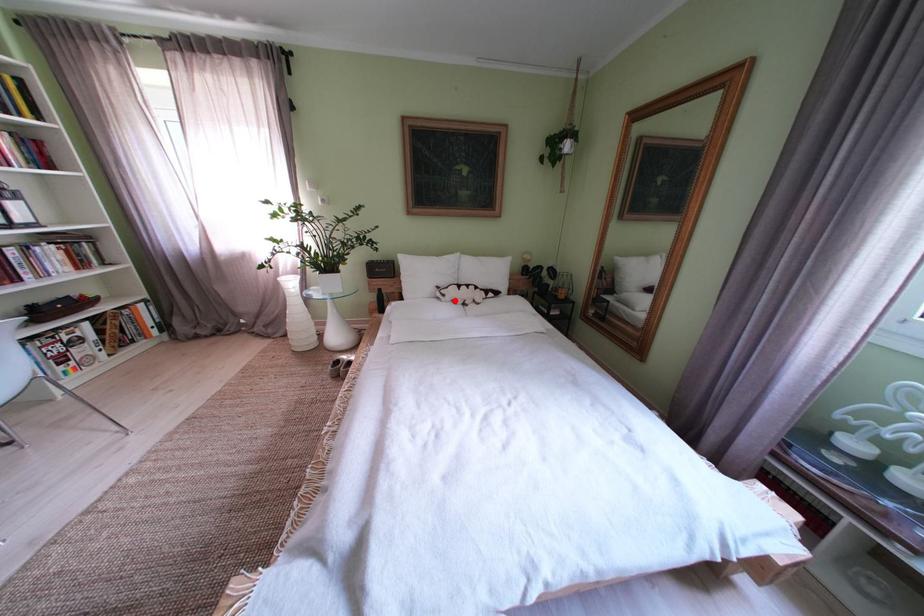
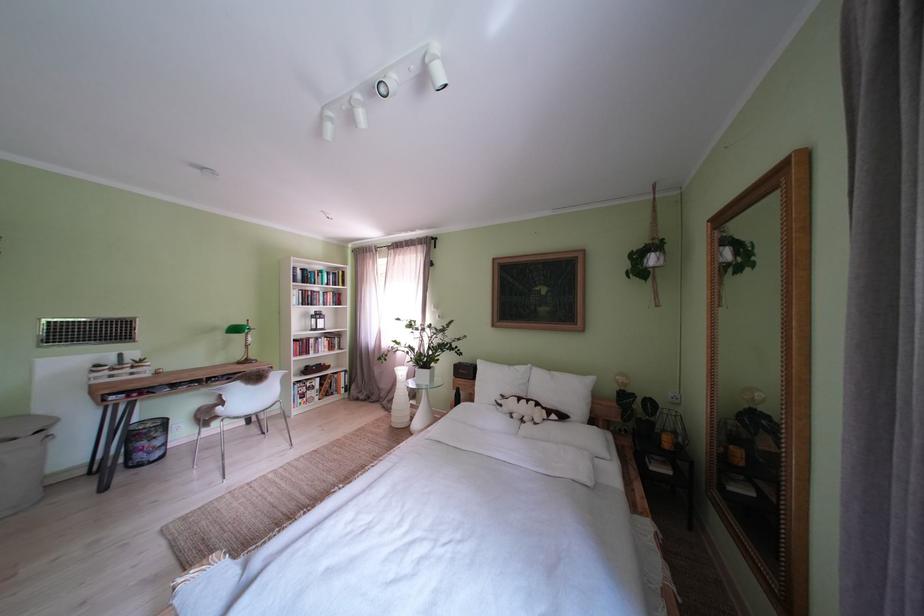
Find the pixel in the second image that matches the highlighted location in the first image.

(512, 411)